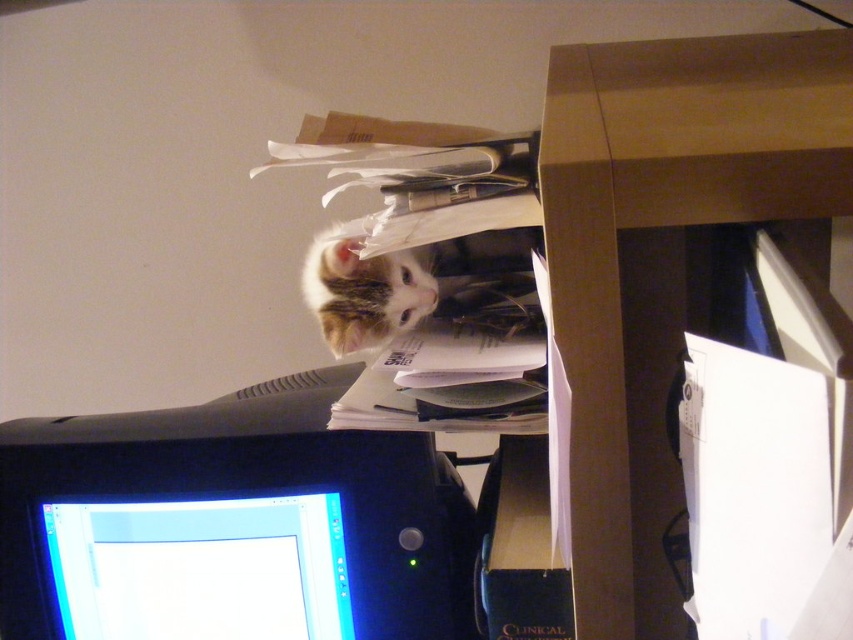
Is point (415, 522) closer to viewer compared to point (404, 289)?

Yes, it is in front of point (404, 289).

Measure the distance from black plastic monitor at lower left to striped fur cat at upper center.

black plastic monitor at lower left and striped fur cat at upper center are 8.15 inches apart from each other.

Measure the distance between point (x=402, y=476) and camera.

Point (x=402, y=476) is 68.05 centimeters away from camera.

Locate an element on the screen. This screenshot has width=853, height=640. black plastic monitor at lower left is located at coordinates (230, 525).

Between matte black monitor at lower left and striped fur cat at upper center, which one appears on the left side from the viewer's perspective?

matte black monitor at lower left is more to the left.

Which is behind, point (288, 525) or point (369, 284)?

The point (288, 525) is behind.

Locate an element on the screen. This screenshot has height=640, width=853. matte black monitor at lower left is located at coordinates (200, 568).

Between point (323, 477) and point (155, 548), which one is positioned in front?

Point (323, 477) is in front.

Between black plastic monitor at lower left and matte black monitor at lower left, which one has less height?

Standing shorter between the two is matte black monitor at lower left.

Is point (33, 504) positioned behind point (289, 618)?

Yes, it is.

Locate an element on the screen. This screenshot has height=640, width=853. black plastic monitor at lower left is located at coordinates (230, 525).